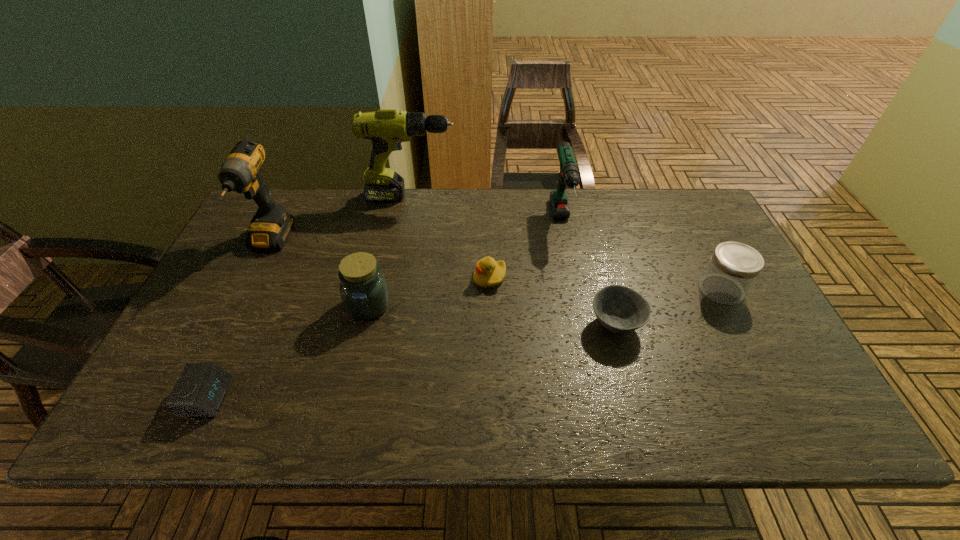
This screenshot has width=960, height=540. Find the location of `free region located 0.360m on the front-facing side of the nearest object`. free region located 0.360m on the front-facing side of the nearest object is located at coordinates (391, 397).

At what (x,y) coordinates should I click in order to perform the action: click on object that is at the near edge. Please return your answer as a coordinate pair (x, y). The image size is (960, 540). Looking at the image, I should click on (200, 390).

The height and width of the screenshot is (540, 960). I want to click on drill present at the left edge, so click(271, 225).

The image size is (960, 540). Find the location of `alarm clock present at the left edge`. alarm clock present at the left edge is located at coordinates (200, 390).

Identify the location of object present at the right edge. Image resolution: width=960 pixels, height=540 pixels. point(733,267).

Where is `object that is positioned at the far left corner`? This screenshot has height=540, width=960. object that is positioned at the far left corner is located at coordinates (271, 225).

You are a GUI agent. You are given a task and a screenshot of the screen. Output one action in this format:
    pyautogui.click(x=<x>, y=<y>)
    Task: Click on the object that is at the near left corner
    This screenshot has height=540, width=960.
    Given the screenshot: What is the action you would take?
    pyautogui.click(x=200, y=390)

In the image, there is a desktop. Where is `free space at the far edge`? This screenshot has height=540, width=960. free space at the far edge is located at coordinates (545, 193).

Identify the location of free space at the near edge of the desktop. (332, 434).

Image resolution: width=960 pixels, height=540 pixels. In order to click on free space at the left edge of the desktop in this screenshot , I will do `click(276, 255)`.